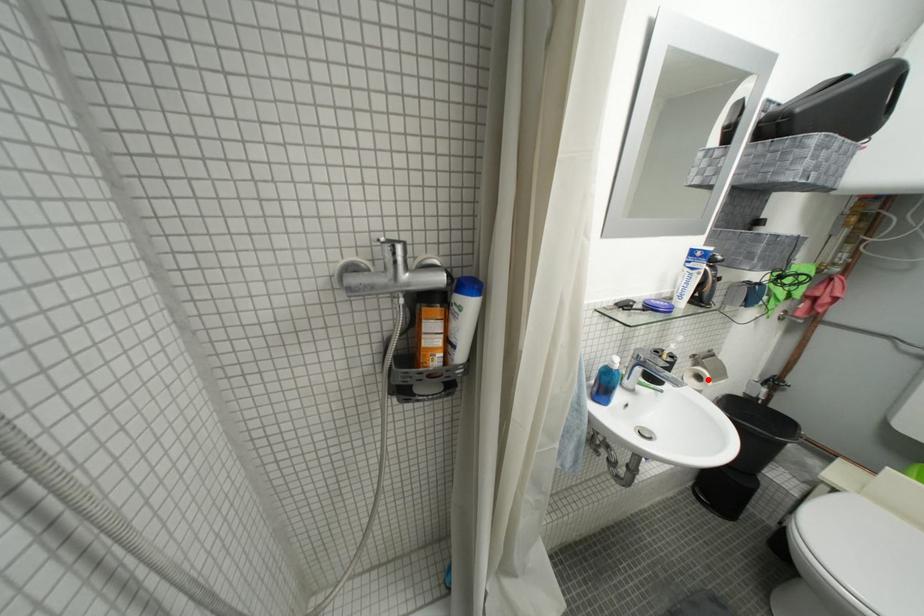
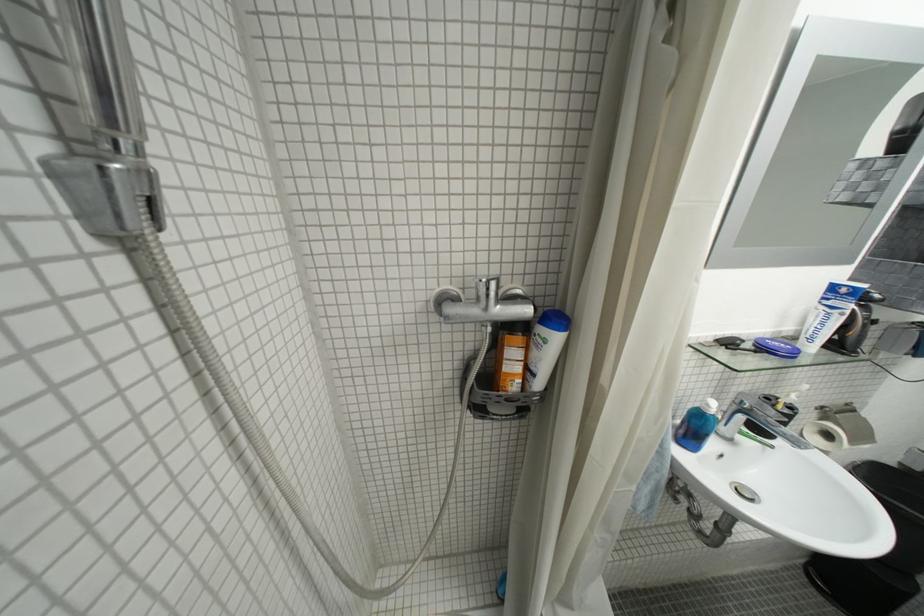
Find the pixel in the second image that matches the highlighted location in the first image.

(836, 438)